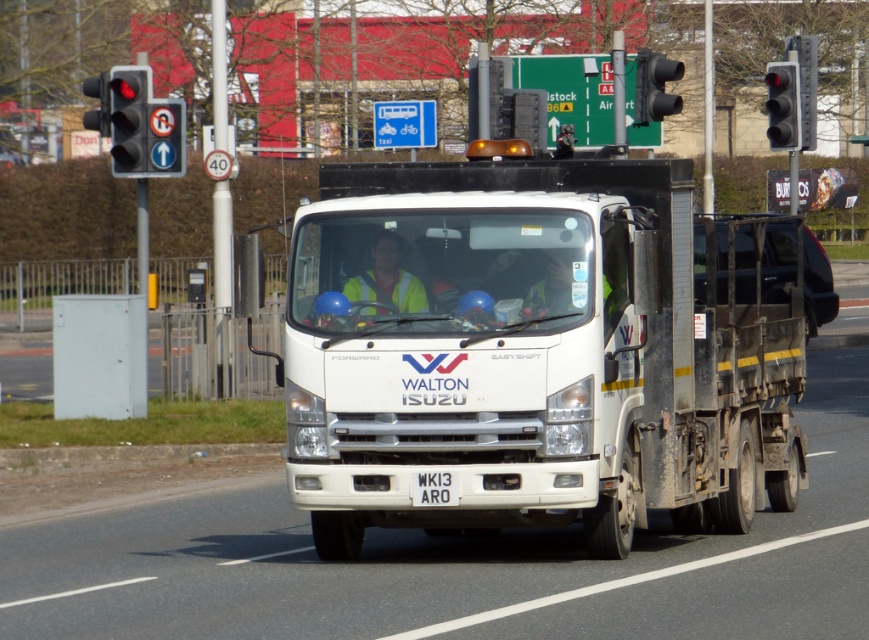
Question: Does white plastic license plate at center have a smaller size compared to red glass traffic light at upper left?

Choices:
 (A) yes
 (B) no

Answer: (A)

Question: Among these points, which one is nearest to the camera?

Choices:
 (A) (370, 269)
 (B) (101, 120)
 (C) (780, 138)

Answer: (A)

Question: Does red glass traffic light at left appear over white plastic license plate at center?

Choices:
 (A) yes
 (B) no

Answer: (A)

Question: Which point is closer to the camera?

Choices:
 (A) red glass traffic light at upper left
 (B) red glass traffic light at upper right

Answer: (A)

Question: Is white matte truck at center positioned in front of white plastic license plate at center?

Choices:
 (A) yes
 (B) no

Answer: (A)

Question: Which of these objects is positioned closest to the yellow reflective safety vest at center?

Choices:
 (A) red glass traffic light at upper right
 (B) white plastic license plate at center
 (C) black plastic traffic light at upper right
 (D) red glass traffic light at left

Answer: (B)